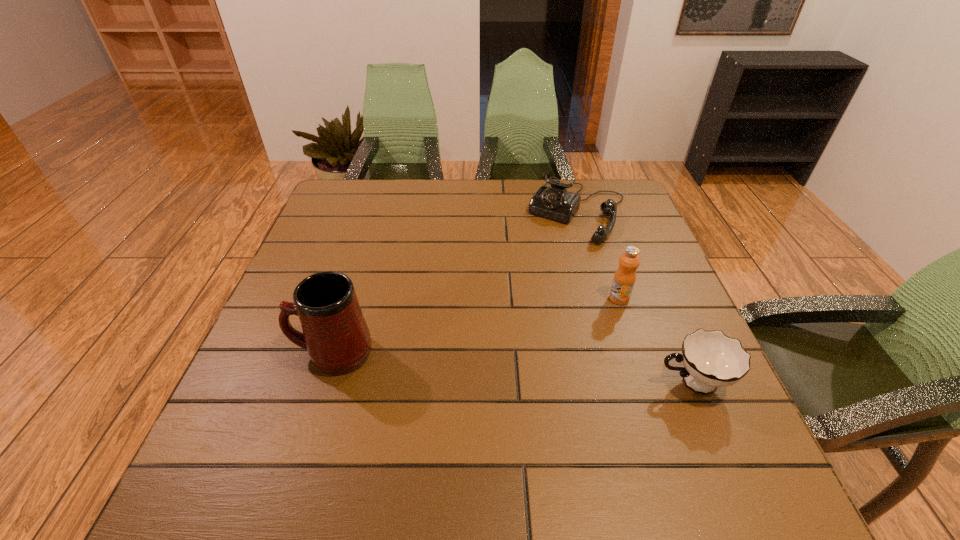
Where is `vacant space that's between the second farthest object and the cup`? The width and height of the screenshot is (960, 540). vacant space that's between the second farthest object and the cup is located at coordinates (656, 341).

Identify the location of free space between the cup and the leftmost object. (513, 368).

Where is `the second closest object to the cup`? Image resolution: width=960 pixels, height=540 pixels. the second closest object to the cup is located at coordinates (555, 202).

Select which object appears as the third closest to the mug. Please provide its 2D coordinates. Your answer should be formatted as a tuple, i.e. [(x, y)], where the tuple contains the x and y coordinates of a point satisfying the conditions above.

[(711, 359)]

Find the location of a particular element. The height and width of the screenshot is (540, 960). free spot that satisfies the following two spatial constraints: 1. on the front side of the telephone; 2. on the side of the cup with the handle is located at coordinates (629, 383).

At what (x,y) coordinates should I click in order to perform the action: click on free space that satisfies the following two spatial constraints: 1. on the front side of the second tallest object; 2. on the right side of the farthest object. Please return your answer as a coordinate pair (x, y). The width and height of the screenshot is (960, 540). Looking at the image, I should click on (604, 299).